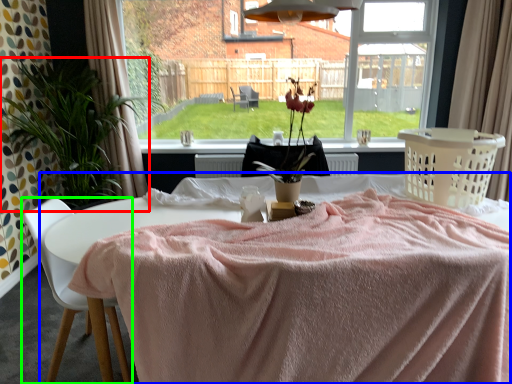
Question: Which is farther away from houseplant (highlighted by a red box)? table (highlighted by a blue box) or chair (highlighted by a green box)?

Choices:
 (A) table
 (B) chair

Answer: (A)